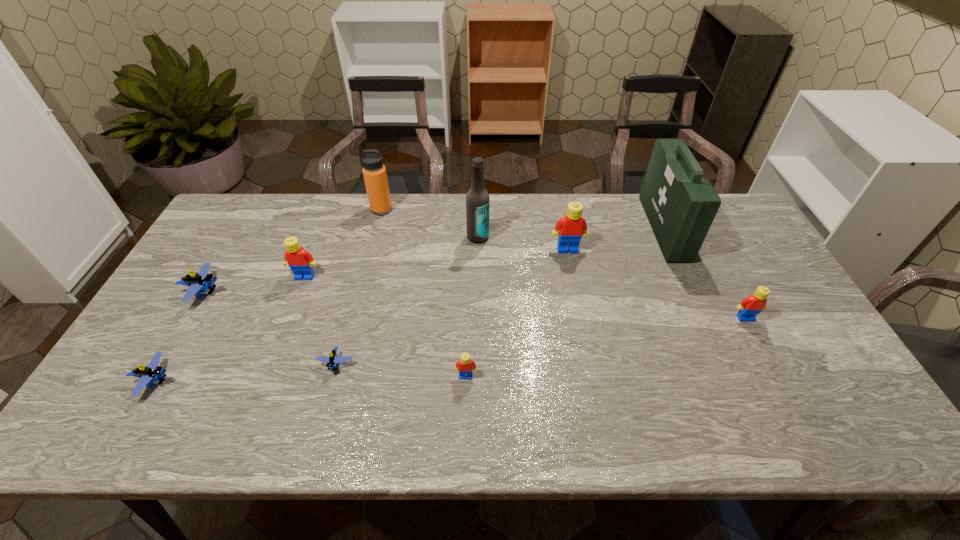
What are the coordinates of `vacant space that's between the first-aid kit and the fifth Lego from right to left` in the screenshot? It's located at (484, 252).

The image size is (960, 540). What are the coordinates of `vacant space in between the smallest red Lego and the farthest blue Lego` in the screenshot? It's located at (335, 334).

The width and height of the screenshot is (960, 540). I want to click on free space between the rightmost red Lego and the fifth Lego from right to left, so click(525, 298).

This screenshot has height=540, width=960. Find the location of `vacant space that is in between the beer bottle and the smallest red Lego`. vacant space that is in between the beer bottle and the smallest red Lego is located at coordinates (472, 307).

Image resolution: width=960 pixels, height=540 pixels. In order to click on free space between the second shortest Lego and the thermos bottle in this screenshot , I will do `click(269, 295)`.

Locate an element on the screen. The height and width of the screenshot is (540, 960). free spot between the seventh shortest object and the shortest object is located at coordinates (452, 307).

Where is `free space that is in between the rightmost Lego and the third Lego from right to left`? This screenshot has height=540, width=960. free space that is in between the rightmost Lego and the third Lego from right to left is located at coordinates (606, 347).

Identify the location of the ninth closest object to the beer bottle. The height and width of the screenshot is (540, 960). (152, 372).

Identify which object is the third closest to the nearest red Lego. Please provide its 2D coordinates. Your answer should be formatted as a tuple, i.e. [(x, y)], where the tuple contains the x and y coordinates of a point satisfying the conditions above.

[(569, 230)]

Choose which Lego is the sixth nearest neighbor to the fifth Lego from right to left. Please provide its 2D coordinates. Your answer should be formatted as a tuple, i.e. [(x, y)], where the tuple contains the x and y coordinates of a point satisfying the conditions above.

[(750, 306)]